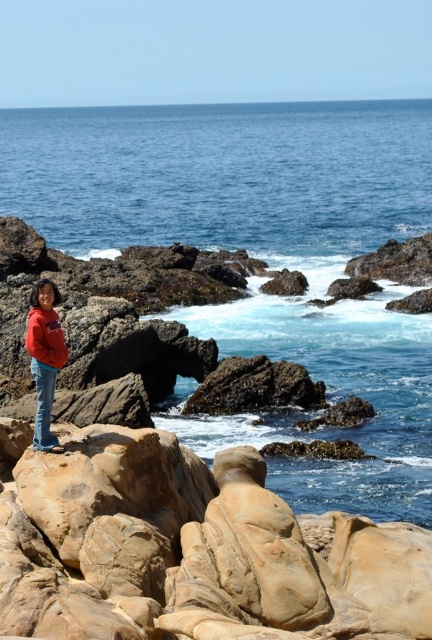
You are a photographer trying to capture a clear shot of both the matte red hoodie at center and the matte red jacket at lower left. Since they are both red, you want to ensure they are distinguishable in the photo. Which object should you focus on first to make sure it stands out more due to its size?

The matte red hoodie at center is taller than the matte red jacket at lower left, so focusing on the matte red hoodie at center first will ensure it stands out more due to its larger size.

You are a photographer trying to capture the entire scene in one shot. Given that the blue smooth water at center and the matte red jacket at lower left are both important elements, which object should you prioritize framing first to ensure it fits in the photo?

The blue smooth water at center is larger in size than the matte red jacket at lower left, so you should prioritize framing the blue smooth water at center first to ensure it fits in the photo.

You are a photographer trying to capture the person in the red hoodie at center. You want to focus on the exact point at coordinate point (44,356). Where exactly on the person should you aim your camera to hit that point?

The point (44,356) is on the matte red hoodie at center, so you should aim your camera at the matte red hoodie at center to hit that point.